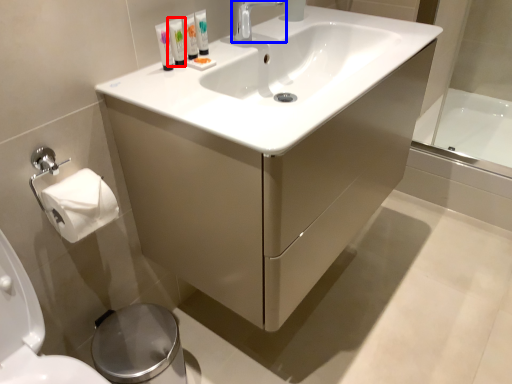
Question: Which object appears farthest to the camera in this image, mouthwash (highlighted by a red box) or tap (highlighted by a blue box)?

Choices:
 (A) mouthwash
 (B) tap

Answer: (B)